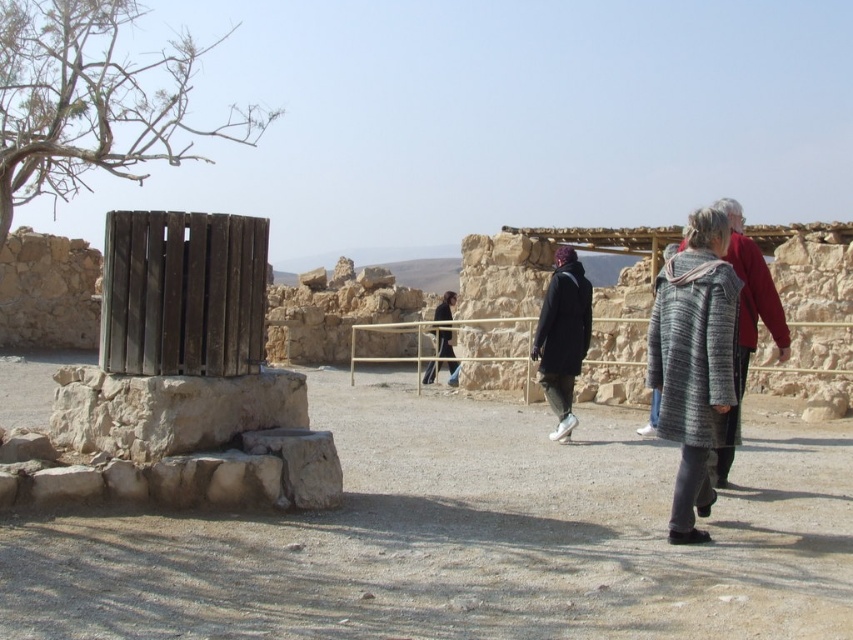
You are a visitor at this historical site and want to take a photo of the dark brown leather jacket at center without the natural stone wall at lower left appearing in the frame. Is this possible?

The natural stone wall at lower left is closer to the viewer than the dark brown leather jacket at center, so moving the camera position to the right or left could allow you to exclude the natural stone wall at lower left from the frame while capturing the dark brown leather jacket at center.

You are standing at the entrance of the historical site and see the point at coordinates [169,410]. What object is located at that point?

The natural stone wall at lower left is located at point [169,410].